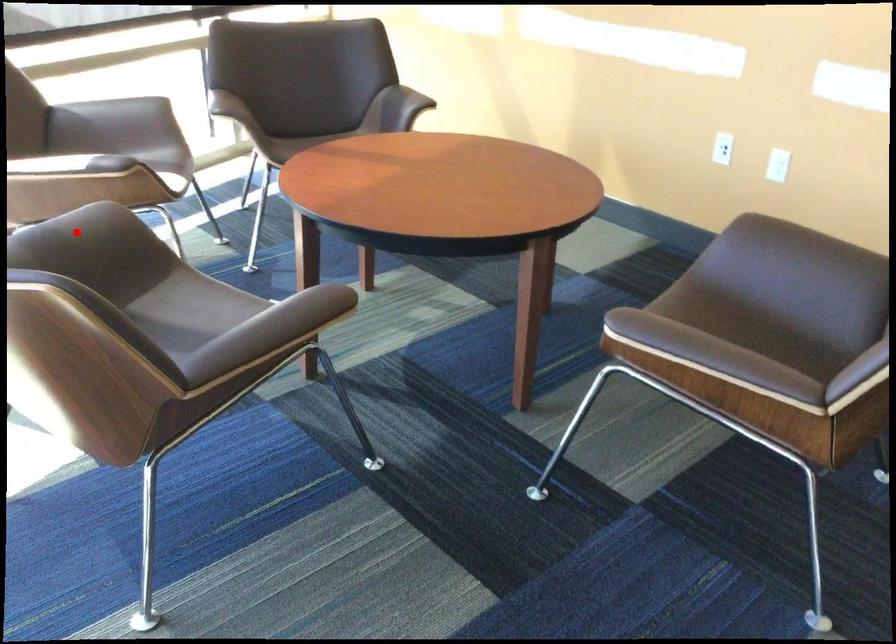
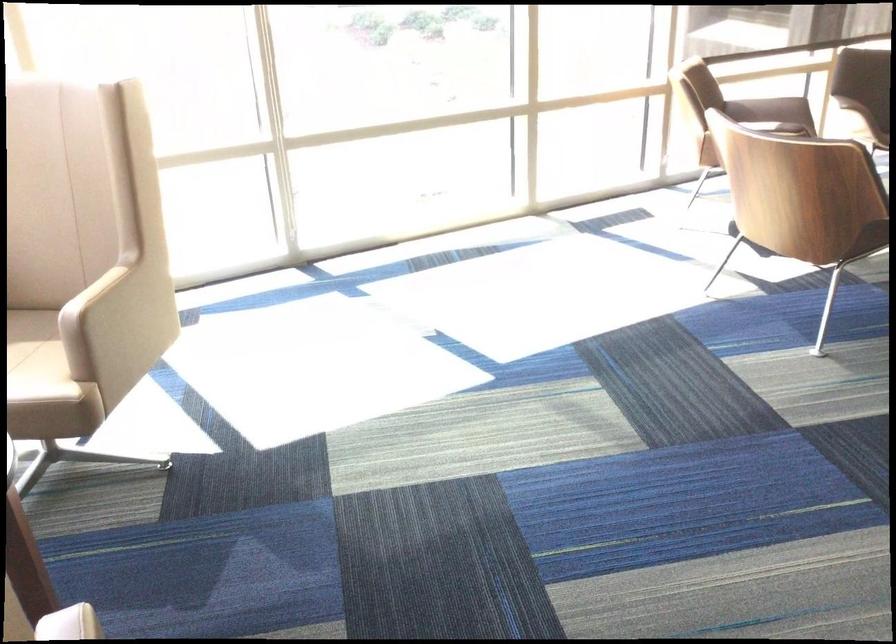
Question: I am providing you with two images of the same scene from different viewpoints. A red point is marked on the first image. Can you still see the location of the red point in image 2?

Choices:
 (A) Yes
 (B) No

Answer: (B)